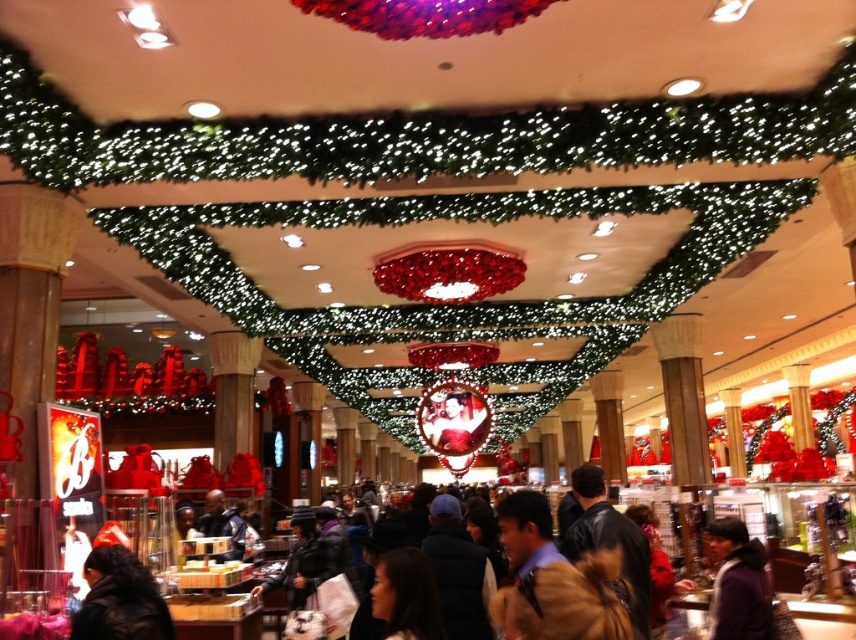
You are standing in the shopping area and want to find the black leather jacket at lower left. According to the coordinates provided, where exactly should you look to find it?

The black leather jacket at lower left is located at point (x=120, y=600), so you should look towards the lower left area of the image, specifically at the coordinates 0.938 on the x and 0.141 on the y axis.

You are standing in the shopping area and see both the black leather jacket at lower left and the purple fuzzy jacket at lower right. Which jacket is positioned more to the left side of the scene?

The black leather jacket at lower left is positioned more to the left side of the scene compared to the purple fuzzy jacket at lower right.

You are a store employee who needs to place a new sign that is 1.2 meters tall. You have to decide between placing it next to the purple fuzzy jacket at lower right or the dark blue leather jacket at center. Which jacket should the sign be placed next to so that the sign is shorter than the jacket?

The purple fuzzy jacket at lower right is taller than the dark blue leather jacket at center. Therefore, the sign should be placed next to the purple fuzzy jacket at lower right since it is taller and the sign at 1.2 meters will be shorter than it.